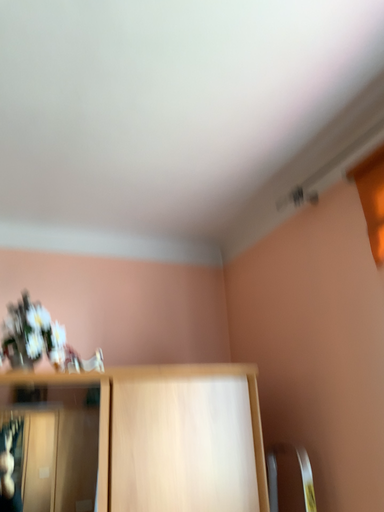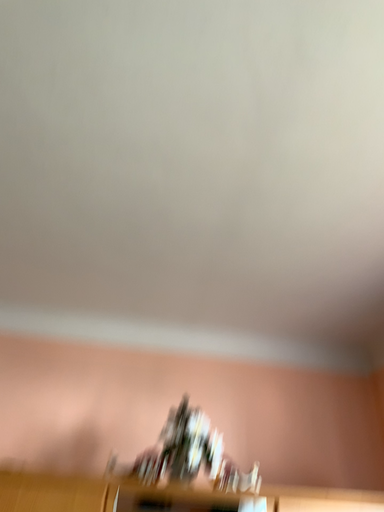
Question: Which way did the camera rotate in the video?

Choices:
 (A) rotated downward
 (B) rotated upward

Answer: (B)